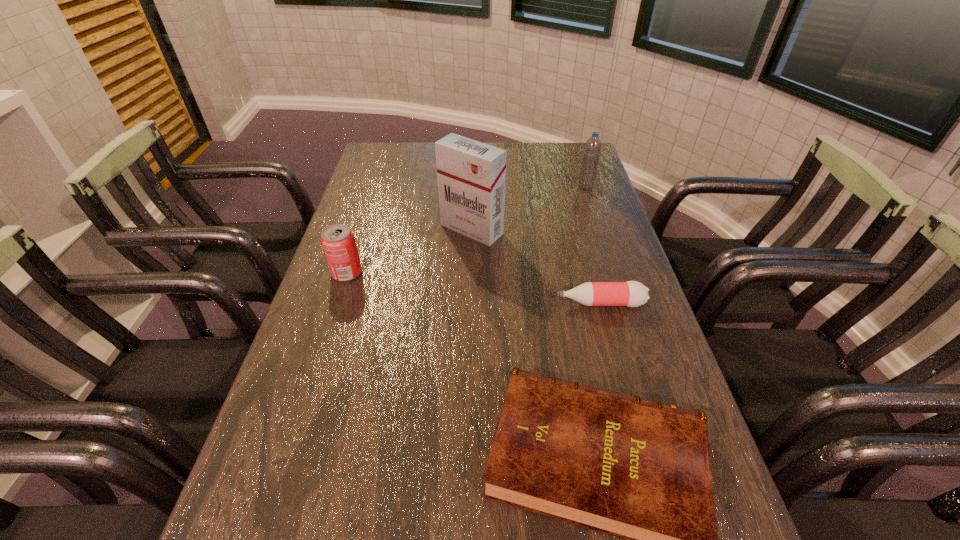
You are a GUI agent. You are given a task and a screenshot of the screen. Output one action in this format:
    pyautogui.click(x=<x>, y=<y>)
    Task: Click on the tallest object
    This screenshot has height=540, width=960.
    Given the screenshot: What is the action you would take?
    [471, 175]

You are a GUI agent. You are given a task and a screenshot of the screen. Output one action in this format:
    pyautogui.click(x=<x>, y=<y>)
    Task: Click on the second farthest object
    The image size is (960, 540).
    Given the screenshot: What is the action you would take?
    pyautogui.click(x=471, y=175)

Identify the location of water bottle. point(592,149).

Where is `the farthest object`? This screenshot has width=960, height=540. the farthest object is located at coordinates (592, 149).

This screenshot has height=540, width=960. I want to click on soda can, so click(338, 242).

You are a GUI agent. You are given a task and a screenshot of the screen. Output one action in this format:
    pyautogui.click(x=<x>, y=<y>)
    Task: Click on the third tallest object
    This screenshot has height=540, width=960.
    Given the screenshot: What is the action you would take?
    pyautogui.click(x=338, y=242)

I want to click on bottle, so click(x=631, y=293).

Image resolution: width=960 pixels, height=540 pixels. Find the location of `free space located 0.360m on the front of the fourth nearest object`. free space located 0.360m on the front of the fourth nearest object is located at coordinates (468, 347).

This screenshot has width=960, height=540. Identify the location of vacant point located 0.290m on the left of the water bottle. (492, 187).

You are a GUI agent. You are given a task and a screenshot of the screen. Output one action in this format:
    pyautogui.click(x=<x>, y=<y>)
    Task: Click on the vacant area situated 0.390m on the right of the leftmost object
    
    Given the screenshot: What is the action you would take?
    pyautogui.click(x=508, y=273)